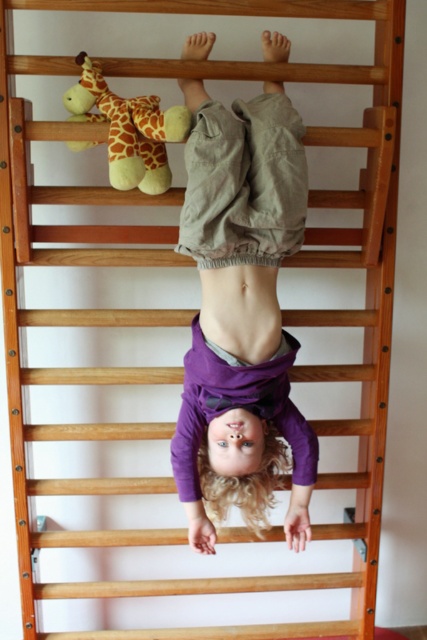
You are a photographer positioned at the origin point. You want to capture a closeup shot of the purple cotton shirt at center. Which direction should you move your camera to focus on the shirt?

The purple cotton shirt at center is located at point 0.483 along the x axis and 0.567 along the y axis. Since the photographer is at the origin, they should move the camera to the right and upwards to focus on the shirt.